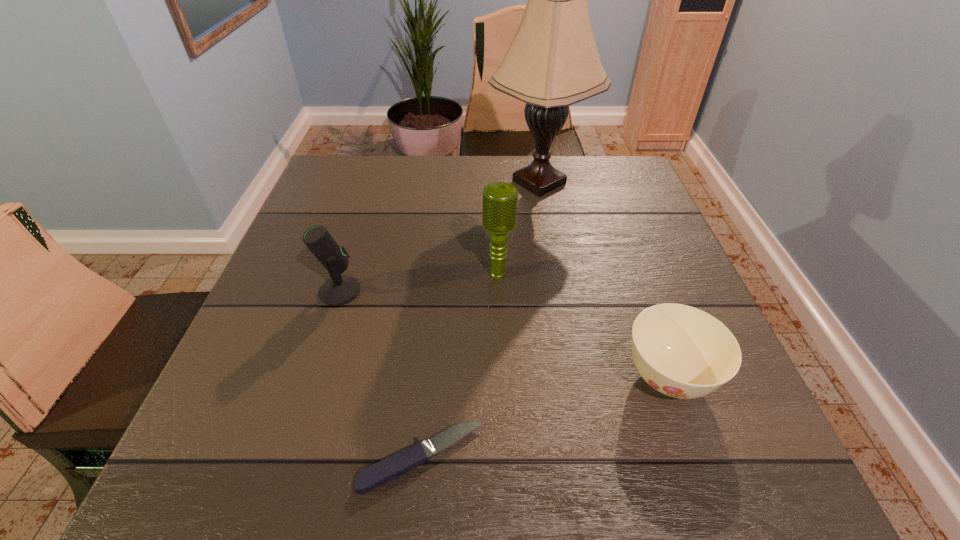
The height and width of the screenshot is (540, 960). In order to click on vacant space located on the front of the farthest object in this screenshot , I will do `click(567, 340)`.

Identify the location of free location located 0.180m on the right of the second tallest object. This screenshot has width=960, height=540. (597, 275).

The height and width of the screenshot is (540, 960). Find the location of `free region located 0.140m on the back of the leftmost object`. free region located 0.140m on the back of the leftmost object is located at coordinates (357, 235).

This screenshot has height=540, width=960. What are the coordinates of `vacant position located 0.200m on the back of the fourth farthest object` in the screenshot? It's located at (628, 267).

This screenshot has height=540, width=960. In order to click on free space located 0.280m on the back of the steak knife in this screenshot , I will do `click(438, 296)`.

Identify the location of object located in the far edge section of the desktop. The height and width of the screenshot is (540, 960). (553, 62).

At what (x,y) coordinates should I click in order to perform the action: click on object located at the near edge. Please return your answer as a coordinate pair (x, y). This screenshot has height=540, width=960. Looking at the image, I should click on (392, 467).

This screenshot has height=540, width=960. In order to click on object at the left edge in this screenshot , I will do pyautogui.click(x=340, y=289).

This screenshot has height=540, width=960. I want to click on lamp located at the right edge, so click(x=553, y=62).

Find the location of a particular element. The height and width of the screenshot is (540, 960). sugar bowl that is at the right edge is located at coordinates (682, 352).